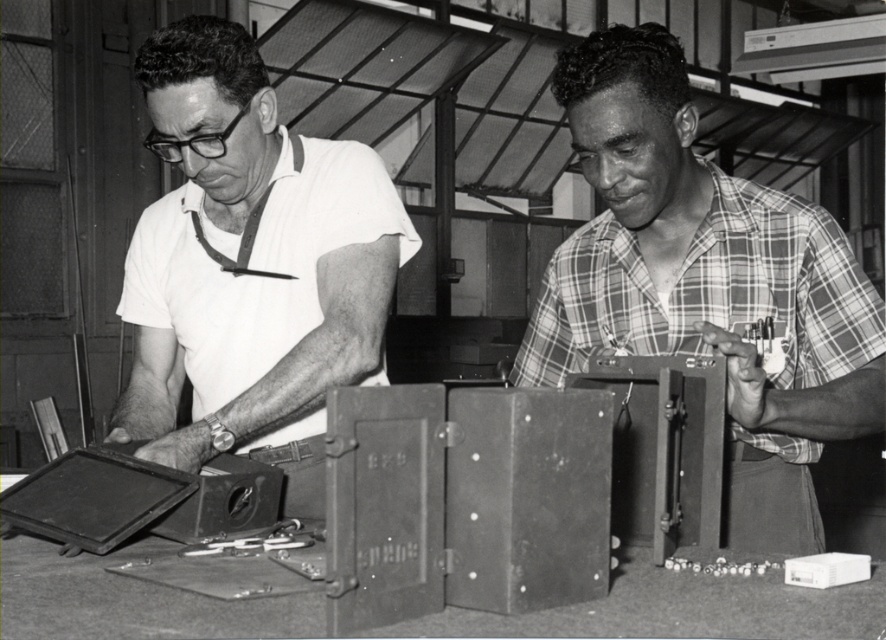
You are a photographer trying to capture a group photo of the two people at the workbench. Since you want everyone to be visible, you need to adjust the camera angle so that both the plaid shirt at center and the matte white shirt at left are fully in frame. Which person should you position closer to the camera to ensure both are visible?

The plaid shirt at center is not as tall as the matte white shirt at left, so you should position the plaid shirt at center closer to the camera to ensure both are fully visible in the frame.